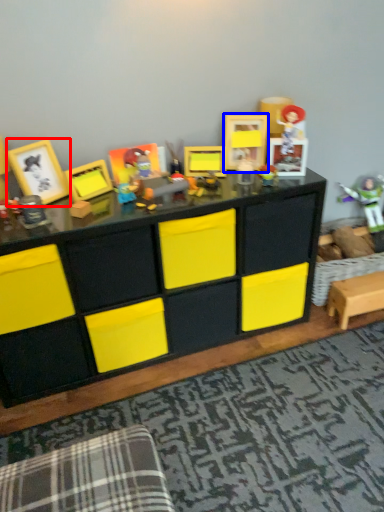
Question: Which of the following is the farthest to the observer, picture frame (highlighted by a red box) or picture frame (highlighted by a blue box)?

Choices:
 (A) picture frame
 (B) picture frame

Answer: (B)